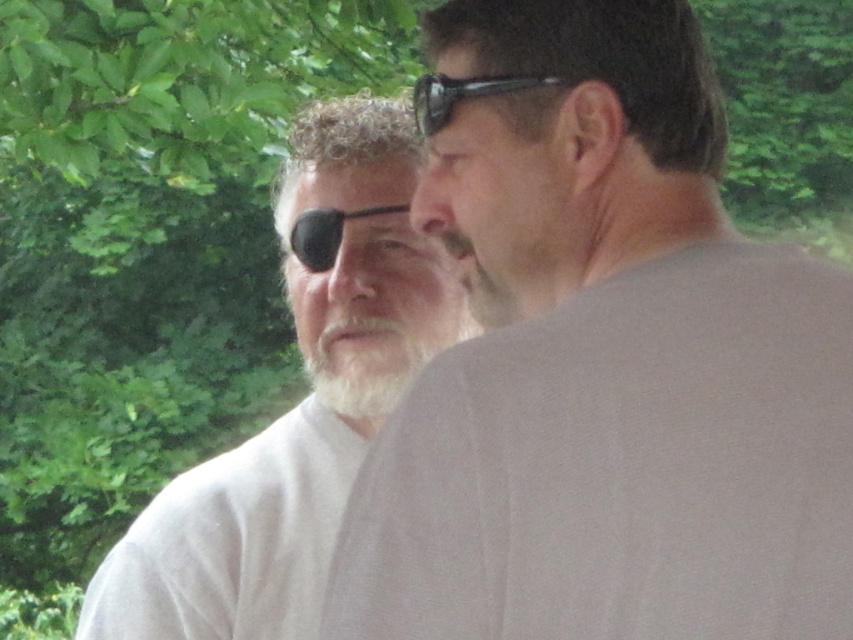
Does point (308, 224) lie behind point (384, 320)?

Yes, point (308, 224) is behind point (384, 320).

This screenshot has height=640, width=853. What do you see at coordinates (300, 403) in the screenshot?
I see `white matte shirt at left` at bounding box center [300, 403].

The width and height of the screenshot is (853, 640). I want to click on white matte shirt at left, so click(x=300, y=403).

I want to click on white matte shirt at left, so click(300, 403).

Can you confirm if white matte shirt at center is positioned to the left of black rubber goggles at upper center?

No, white matte shirt at center is not to the left of black rubber goggles at upper center.

Who is shorter, white matte shirt at center or black rubber goggles at upper center?

black rubber goggles at upper center is shorter.

Identify the location of white matte shirt at center. (605, 365).

Does point (323, 145) lie in front of point (440, 106)?

No, (323, 145) is behind (440, 106).

Is white matte shirt at left above black plastic sunglasses at upper center?

No.

Find the location of a particular element. The width and height of the screenshot is (853, 640). white matte shirt at left is located at coordinates (300, 403).